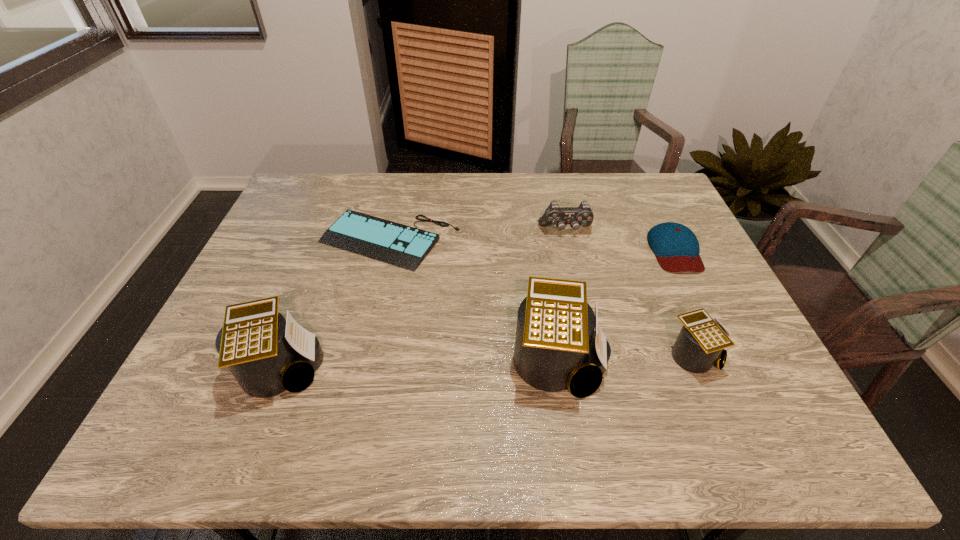
You are a GUI agent. You are given a task and a screenshot of the screen. Output one action in this format:
    pyautogui.click(x=<x>, y=<y>)
    Task: Click on the vacant space located on the surface of the control with buttons
    Image resolution: width=960 pixels, height=540 pixels.
    Given the screenshot: What is the action you would take?
    pyautogui.click(x=576, y=278)

Locate an element on the screen. The width and height of the screenshot is (960, 540). vacant region located with the bill of the second shortest object facing forward is located at coordinates (734, 374).

In order to click on vacant region located 0.050m on the back of the shortest object in this screenshot , I will do 398,205.

Identify the location of calculator that is at the left edge. The image size is (960, 540). (267, 355).

Find the location of a particular element. computer keyboard present at the left edge is located at coordinates (404, 246).

Identify the location of calculator located at the right edge. (701, 341).

Where is `baseball cap present at the right edge`? The image size is (960, 540). baseball cap present at the right edge is located at coordinates (676, 248).

Image resolution: width=960 pixels, height=540 pixels. Identify the location of object positioned at the near left corner. (267, 355).

The image size is (960, 540). What are the coordinates of `object that is at the near right corner` in the screenshot? It's located at (701, 341).

I want to click on free space at the far edge, so click(493, 208).